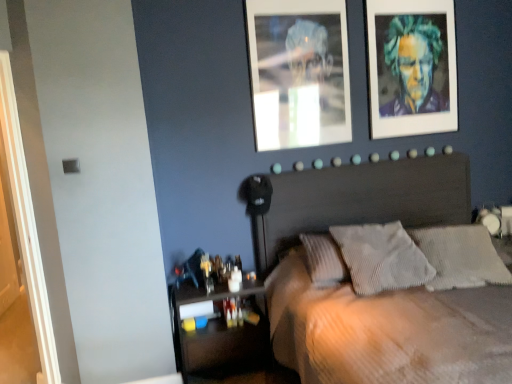
Question: Is white painted wood door at left taller than translucent plastic shelf at lower left?

Choices:
 (A) yes
 (B) no

Answer: (A)

Question: Is white painted wood door at left far away from translucent plastic shelf at lower left?

Choices:
 (A) yes
 (B) no

Answer: (A)

Question: Can you confirm if white painted wood door at left is positioned to the right of translucent plastic shelf at lower left?

Choices:
 (A) yes
 (B) no

Answer: (B)

Question: Does white painted wood door at left have a larger size compared to translucent plastic shelf at lower left?

Choices:
 (A) yes
 (B) no

Answer: (B)

Question: Is white painted wood door at left next to translucent plastic shelf at lower left?

Choices:
 (A) yes
 (B) no

Answer: (B)

Question: Would you say translucent plastic shelf at lower left is to the left or to the right of white painted wood door at left in the picture?

Choices:
 (A) right
 (B) left

Answer: (A)

Question: From a real-world perspective, relative to white painted wood door at left, is translucent plastic shelf at lower left vertically above or below?

Choices:
 (A) above
 (B) below

Answer: (B)

Question: Considering the positions of translucent plastic shelf at lower left and white painted wood door at left in the image, is translucent plastic shelf at lower left taller or shorter than white painted wood door at left?

Choices:
 (A) short
 (B) tall

Answer: (A)

Question: In terms of width, does translucent plastic shelf at lower left look wider or thinner when compared to white painted wood door at left?

Choices:
 (A) wide
 (B) thin

Answer: (A)

Question: Which is correct: metallic silver photo frame at upper center is inside white painted wood door at left, or outside of it?

Choices:
 (A) inside
 (B) outside

Answer: (B)

Question: From the image's perspective, is metallic silver photo frame at upper center located above or below white painted wood door at left?

Choices:
 (A) above
 (B) below

Answer: (A)

Question: Is point (316, 41) closer or farther from the camera than point (20, 187)?

Choices:
 (A) closer
 (B) farther

Answer: (B)

Question: In the image, is metallic silver photo frame at upper center on the left side or the right side of white painted wood door at left?

Choices:
 (A) left
 (B) right

Answer: (B)

Question: Considering the positions of gray corduroy pillow at center, which is the 1th pillow from right to left, and gray corduroy pillow at center, which ranks as the first pillow in left-to-right order, in the image, is gray corduroy pillow at center, which is the 1th pillow from right to left, wider or thinner than gray corduroy pillow at center, which ranks as the first pillow in left-to-right order,?

Choices:
 (A) thin
 (B) wide

Answer: (B)

Question: Considering the positions of point (442, 228) and point (423, 271), is point (442, 228) closer or farther from the camera than point (423, 271)?

Choices:
 (A) farther
 (B) closer

Answer: (A)